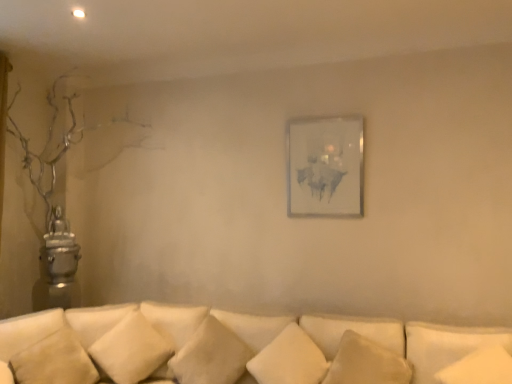
Question: Does white soft pillow at lower center, the 6th pillow when ordered from left to right, have a lesser height compared to matte white picture frame at center?

Choices:
 (A) yes
 (B) no

Answer: (A)

Question: Is white soft pillow at lower center, the second pillow positioned from the right, behind matte white picture frame at center?

Choices:
 (A) yes
 (B) no

Answer: (B)

Question: Considering the relative positions of white soft pillow at lower center, the 6th pillow when ordered from left to right, and matte white picture frame at center in the image provided, is white soft pillow at lower center, the 6th pillow when ordered from left to right, to the right of matte white picture frame at center from the viewer's perspective?

Choices:
 (A) yes
 (B) no

Answer: (A)

Question: Is white soft pillow at lower center, the 6th pillow when ordered from left to right, outside matte white picture frame at center?

Choices:
 (A) no
 (B) yes

Answer: (B)

Question: Could you tell me if white soft pillow at lower center, the 6th pillow when ordered from left to right, is turned towards matte white picture frame at center?

Choices:
 (A) yes
 (B) no

Answer: (B)

Question: From the image's perspective, is white soft pillow at lower center, the second pillow positioned from the right, above or below white soft pillow at lower left, which appears as the seventh pillow when viewed from the right?

Choices:
 (A) below
 (B) above

Answer: (A)

Question: Is point (385, 362) positioned closer to the camera than point (22, 340)?

Choices:
 (A) farther
 (B) closer

Answer: (B)

Question: Considering their positions, is white soft pillow at lower center, the 6th pillow when ordered from left to right, located in front of or behind white soft pillow at lower left, which appears as the seventh pillow when viewed from the right?

Choices:
 (A) front
 (B) behind

Answer: (B)

Question: Is white soft pillow at lower center, the 6th pillow when ordered from left to right, inside or outside of white soft pillow at lower left, which appears as the seventh pillow when viewed from the right?

Choices:
 (A) inside
 (B) outside

Answer: (B)

Question: Would you say matte white picture frame at center is to the left or to the right of white soft pillow at lower center, the second pillow positioned from the right, in the picture?

Choices:
 (A) left
 (B) right

Answer: (A)

Question: Is point (344, 115) closer or farther from the camera than point (387, 369)?

Choices:
 (A) farther
 (B) closer

Answer: (A)

Question: Is matte white picture frame at center taller or shorter than white soft pillow at lower center, the 6th pillow when ordered from left to right?

Choices:
 (A) tall
 (B) short

Answer: (A)

Question: Considering the positions of matte white picture frame at center and white soft pillow at lower center, the second pillow positioned from the right, in the image, is matte white picture frame at center wider or thinner than white soft pillow at lower center, the second pillow positioned from the right,?

Choices:
 (A) thin
 (B) wide

Answer: (A)

Question: Is white soft pillow at lower right, the first pillow in the right-to-left sequence, in front of or behind white soft pillow at lower center, the third pillow when ordered from left to right, in the image?

Choices:
 (A) behind
 (B) front

Answer: (B)

Question: Which is correct: white soft pillow at lower right, the first pillow in the right-to-left sequence, is inside white soft pillow at lower center, the fifth pillow viewed from the right, or outside of it?

Choices:
 (A) outside
 (B) inside

Answer: (A)